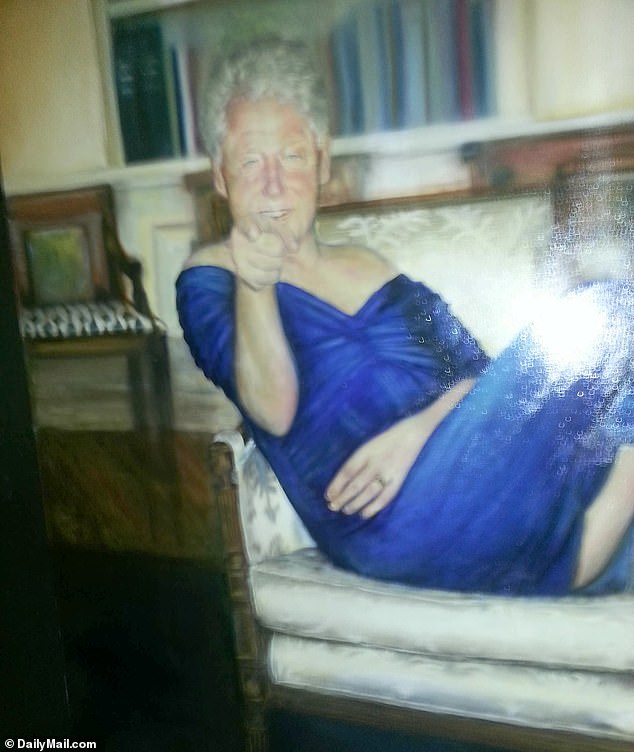
Find the location of `chair`. chair is located at coordinates (89, 258).